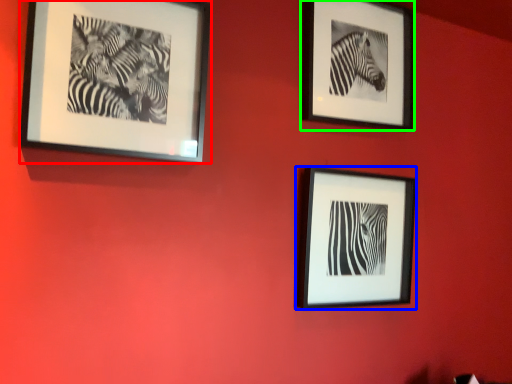
Question: Considering the real-world distances, which object is farthest from picture frame (highlighted by a red box)? picture frame (highlighted by a blue box) or picture frame (highlighted by a green box)?

Choices:
 (A) picture frame
 (B) picture frame

Answer: (A)